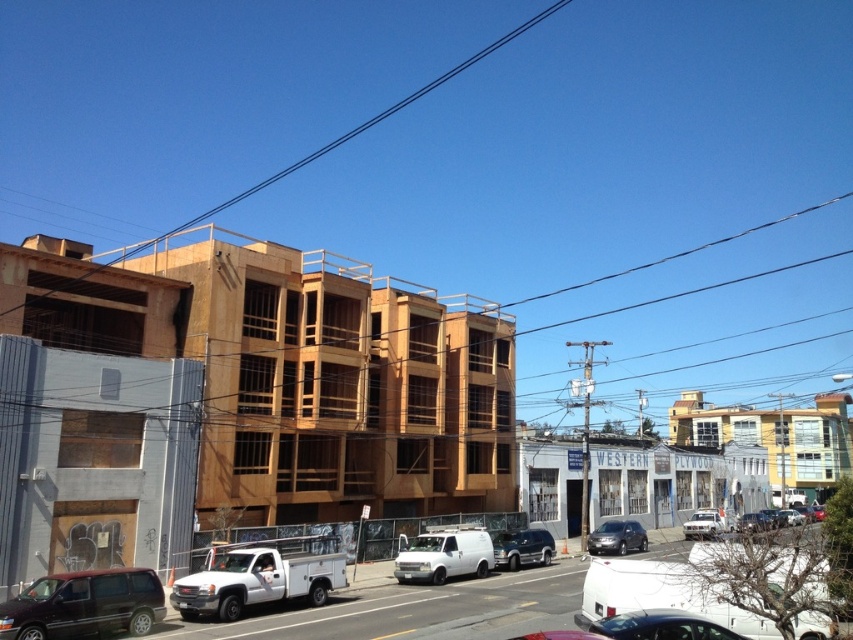
Question: Based on their relative distances, which object is nearer to the metallic silver sedan at center-right?

Choices:
 (A) white matte van at center
 (B) shiny black sedan at center
 (C) metallic silver van at center
 (D) matte black van at lower left

Answer: (B)

Question: Estimate the real-world distances between objects in this image. Which object is closer to the white matte van at center?

Choices:
 (A) metallic silver van at center
 (B) shiny black sedan at center

Answer: (A)

Question: Is white matte van at center wider than metallic silver van at center?

Choices:
 (A) yes
 (B) no

Answer: (A)

Question: Is matte black van at lower left thinner than white matte van at center?

Choices:
 (A) no
 (B) yes

Answer: (A)

Question: Which point is closer to the camera?

Choices:
 (A) metallic silver sedan at center-right
 (B) shiny black sedan at center
 (C) metallic silver van at center

Answer: (B)

Question: Is shiny black sedan at lower right further to the viewer compared to shiny black sedan at center?

Choices:
 (A) no
 (B) yes

Answer: (B)